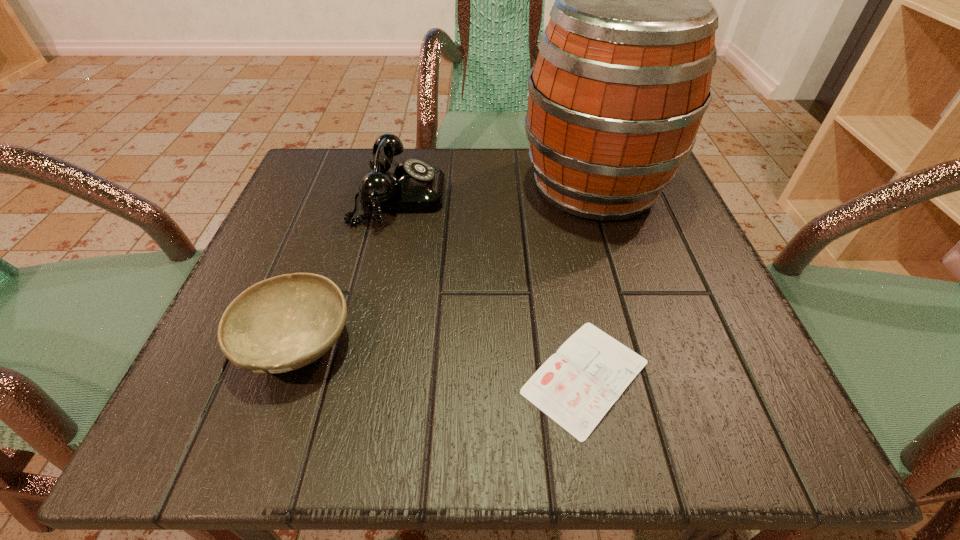
Locate an element on the screen. The width and height of the screenshot is (960, 540). bowl located in the near edge section of the desktop is located at coordinates (283, 323).

Image resolution: width=960 pixels, height=540 pixels. What are the coordinates of `diary that is positioned at the near edge` in the screenshot? It's located at (576, 387).

What are the coordinates of `telephone positioned at the left edge` in the screenshot? It's located at (412, 186).

This screenshot has width=960, height=540. In order to click on bowl at the left edge in this screenshot , I will do coord(283,323).

Locate an element on the screen. Image resolution: width=960 pixels, height=540 pixels. cider positioned at the right edge is located at coordinates (621, 82).

Where is `diary that is at the right edge`? Image resolution: width=960 pixels, height=540 pixels. diary that is at the right edge is located at coordinates (576, 387).

What are the coordinates of `object present at the far left corner` in the screenshot? It's located at tap(412, 186).

Image resolution: width=960 pixels, height=540 pixels. I want to click on object at the near left corner, so click(283, 323).

Image resolution: width=960 pixels, height=540 pixels. I want to click on object that is positioned at the far right corner, so click(621, 82).

Where is `object present at the near right corner`? object present at the near right corner is located at coordinates (576, 387).